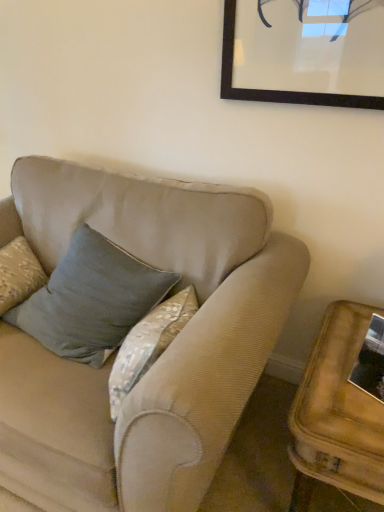
Question: Does point (314, 431) appear closer or farther from the camera than point (362, 349)?

Choices:
 (A) farther
 (B) closer

Answer: (B)

Question: Considering the positions of wooden side table at lower right and metallic reflective frame at lower right in the image, is wooden side table at lower right bigger or smaller than metallic reflective frame at lower right?

Choices:
 (A) small
 (B) big

Answer: (B)

Question: Which of these objects is positioned closest to the wooden side table at lower right?

Choices:
 (A) velvet blue pillow at center
 (B) metallic reflective frame at lower right

Answer: (B)

Question: Estimate the real-world distances between objects in this image. Which object is farther from the velvet blue pillow at center?

Choices:
 (A) wooden side table at lower right
 (B) metallic reflective frame at lower right

Answer: (B)